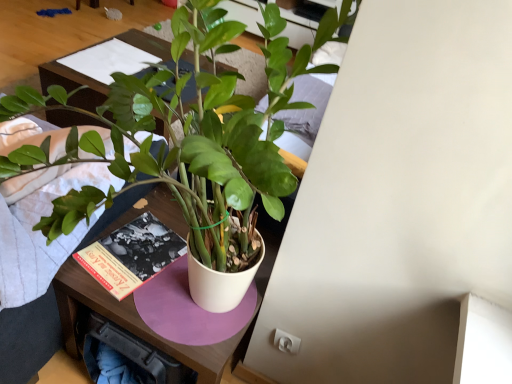
Measure the distance between point (x=224, y=260) and camera.

They are 3.55 feet apart.

What do you see at coordinates (185, 133) in the screenshot?
I see `green glossy plant at center` at bounding box center [185, 133].

Where is `green glossy plant at center`? green glossy plant at center is located at coordinates (185, 133).

In order to face matte wood table at center, should I rotate leftwards or rightwards?

You should rotate left by 14.455 degrees.

Describe the element at coordinates (102, 67) in the screenshot. I see `matte wood table at center` at that location.

Measure the distance between matte wood table at center and camera.

matte wood table at center is 5.37 feet away from camera.

The width and height of the screenshot is (512, 384). What are the coordinates of `matte wood table at center` in the screenshot? It's located at (102, 67).

I want to click on green glossy plant at center, so click(185, 133).

Between green glossy plant at center and matte wood table at center, which one appears on the left side from the viewer's perspective?

matte wood table at center is more to the left.

Considering the relative positions of green glossy plant at center and matte wood table at center in the image provided, is green glossy plant at center behind matte wood table at center?

No, green glossy plant at center is closer to the viewer.

Between point (12, 151) and point (86, 51), which one is positioned in front?

The point (12, 151) is closer to the camera.

From the image's perspective, relative to matte wood table at center, is green glossy plant at center above or below?

Based on their image positions, green glossy plant at center is located beneath matte wood table at center.

From a real-world perspective, does green glossy plant at center sit lower than matte wood table at center?

Actually, green glossy plant at center is physically above matte wood table at center in the real world.

Can you confirm if green glossy plant at center is wider than matte wood table at center?

Yes, green glossy plant at center is wider than matte wood table at center.

From their relative heights in the image, would you say green glossy plant at center is taller or shorter than matte wood table at center?

green glossy plant at center is taller than matte wood table at center.

Looking at the image, does green glossy plant at center seem bigger or smaller compared to matte wood table at center?

green glossy plant at center is bigger than matte wood table at center.

Can we say green glossy plant at center lies outside matte wood table at center?

Absolutely, green glossy plant at center is external to matte wood table at center.

Consider the image. Are green glossy plant at center and matte wood table at center located far from each other?

green glossy plant at center is near matte wood table at center, not far away.

In the scene shown: Could you tell me if green glossy plant at center is turned towards matte wood table at center?

No.

In the scene shown: What's the angular difference between green glossy plant at center and matte wood table at center's facing directions?

0.000141 degrees.

How far apart are green glossy plant at center and matte wood table at center?

The distance of green glossy plant at center from matte wood table at center is 96.46 centimeters.

Locate an element on the screen. This screenshot has width=512, height=384. table that is on the left side of green glossy plant at center is located at coordinates (102, 67).

Between matte wood table at center and green glossy plant at center, which one appears on the right side from the viewer's perspective?

green glossy plant at center is more to the right.

Relative to green glossy plant at center, is matte wood table at center in front or behind?

matte wood table at center is behind green glossy plant at center.

Considering the points (181, 57) and (40, 98), which point is behind, point (181, 57) or point (40, 98)?

Point (40, 98)

From the image's perspective, is matte wood table at center over green glossy plant at center?

Yes.

From a real-world perspective, is matte wood table at center positioned above or below green glossy plant at center?

matte wood table at center is below green glossy plant at center.

From the picture: Is matte wood table at center wider than green glossy plant at center?

No, matte wood table at center is not wider than green glossy plant at center.

Does matte wood table at center have a greater height compared to green glossy plant at center?

Incorrect, the height of matte wood table at center is not larger of that of green glossy plant at center.

Which of these two, matte wood table at center or green glossy plant at center, is bigger?

Bigger between the two is green glossy plant at center.

Is matte wood table at center inside the boundaries of green glossy plant at center, or outside?

matte wood table at center cannot be found inside green glossy plant at center.

Is matte wood table at center with green glossy plant at center?

They are not placed beside each other.

Could you tell me if matte wood table at center is facing green glossy plant at center?

Result: No.

How many degrees apart are the facing directions of matte wood table at center and green glossy plant at center?

The angular difference between matte wood table at center and green glossy plant at center is 0.000141 degrees.

Identify the location of houseplant on the right of matte wood table at center. The image size is (512, 384). (185, 133).

Identify the location of table lying on the left of green glossy plant at center. This screenshot has height=384, width=512. (102, 67).

In the image, there is a green glossy plant at center. Where is `table below it (from a real-world perspective)`? The image size is (512, 384). table below it (from a real-world perspective) is located at coordinates (102, 67).